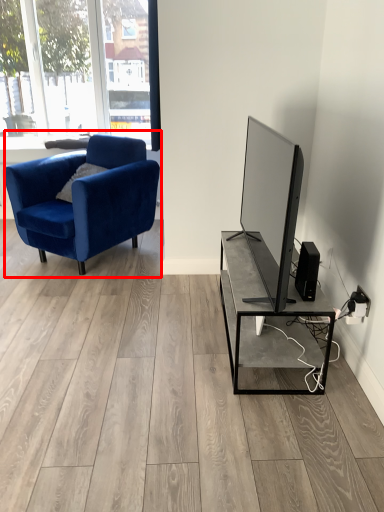
Question: From the image's perspective, considering the relative positions of chair (annotated by the red box) and speaker in the image provided, where is chair (annotated by the red box) located with respect to the staircase?

Choices:
 (A) above
 (B) below

Answer: (A)